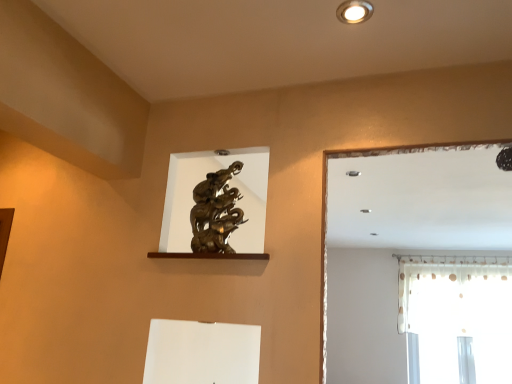
Question: From the image's perspective, relative to matte white recessed light at upper center, is white sheer curtain at right above or below?

Choices:
 (A) below
 (B) above

Answer: (A)

Question: Based on their positions, is white sheer curtain at right located to the left or right of matte white recessed light at upper center?

Choices:
 (A) right
 (B) left

Answer: (A)

Question: Considering the positions of white sheer curtain at right and matte white recessed light at upper center in the image, is white sheer curtain at right wider or thinner than matte white recessed light at upper center?

Choices:
 (A) thin
 (B) wide

Answer: (B)

Question: Is matte white recessed light at upper center wider or thinner than white sheer curtain at right?

Choices:
 (A) thin
 (B) wide

Answer: (A)

Question: In the image, is matte white recessed light at upper center on the left side or the right side of white sheer curtain at right?

Choices:
 (A) left
 (B) right

Answer: (A)

Question: Considering their positions, is matte white recessed light at upper center located in front of or behind white sheer curtain at right?

Choices:
 (A) front
 (B) behind

Answer: (A)

Question: Is matte white recessed light at upper center spatially inside white sheer curtain at right, or outside of it?

Choices:
 (A) outside
 (B) inside

Answer: (A)